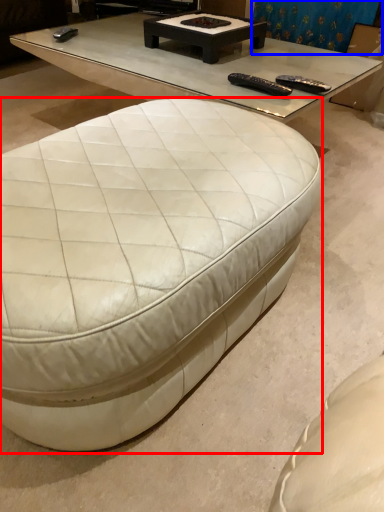
Question: Which object appears closest to the camera in this image, coffee table (highlighted by a red box) or curtain (highlighted by a blue box)?

Choices:
 (A) coffee table
 (B) curtain

Answer: (A)